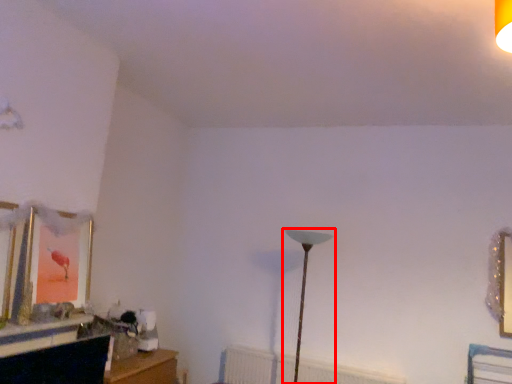
Question: From the image's perspective, where is lamp (annotated by the red box) located in relation to radiator in the image?

Choices:
 (A) below
 (B) above

Answer: (B)